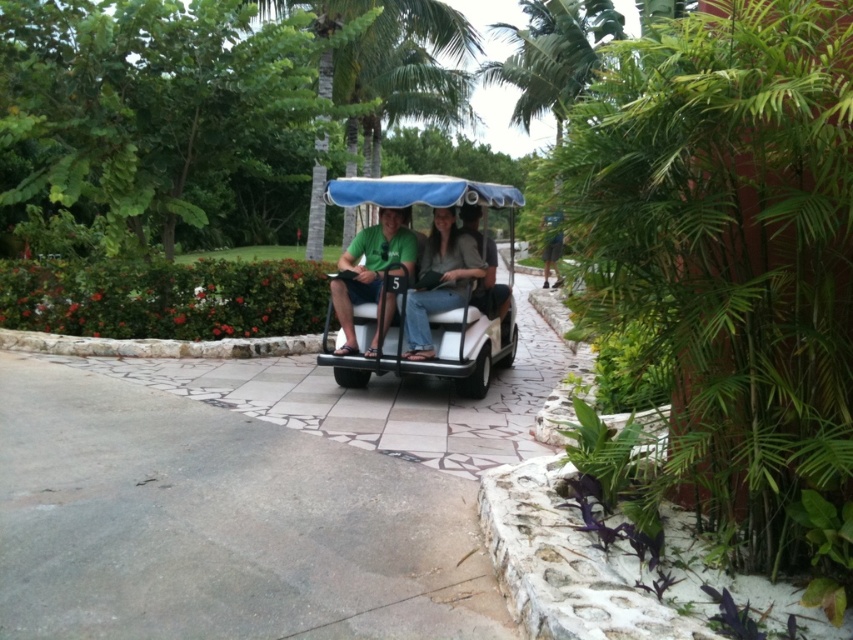
Question: Is denim jeans at center behind matte gray shirt at center?

Choices:
 (A) yes
 (B) no

Answer: (B)

Question: Does white matte golf cart at center appear on the right side of matte gray shirt at center?

Choices:
 (A) no
 (B) yes

Answer: (A)

Question: Which object is the farthest from the denim jeans at center?

Choices:
 (A) white matte golf cart at center
 (B) matte gray shirt at center
 (C) green matte shirt at center

Answer: (B)

Question: Which point is farther to the camera?

Choices:
 (A) (402, 301)
 (B) (494, 314)

Answer: (B)

Question: Does green matte shirt at center have a greater width compared to denim jeans at center?

Choices:
 (A) yes
 (B) no

Answer: (A)

Question: Which of the following is the farthest from the observer?

Choices:
 (A) white matte golf cart at center
 (B) green matte shirt at center
 (C) matte gray shirt at center

Answer: (C)